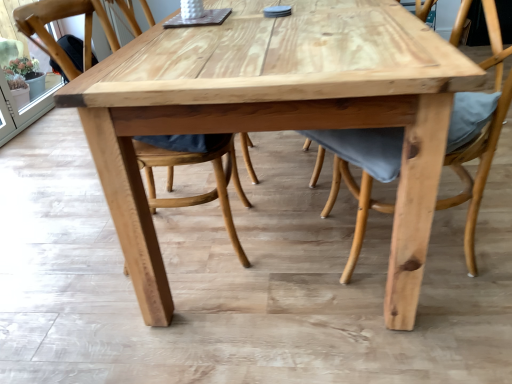
This screenshot has width=512, height=384. What do you see at coordinates (201, 194) in the screenshot?
I see `natural wood chair at center, which appears as the 2th chair when viewed from the right` at bounding box center [201, 194].

Where is `natural wood chair at center, the 1th chair from the left`? The width and height of the screenshot is (512, 384). natural wood chair at center, the 1th chair from the left is located at coordinates (201, 194).

The width and height of the screenshot is (512, 384). What do you see at coordinates (480, 141) in the screenshot? I see `natural wood chair at center, placed as the 2th chair when sorted from left to right` at bounding box center [480, 141].

At what (x,y) coordinates should I click in order to perform the action: click on natural wood chair at center, placed as the 2th chair when sorted from left to right. Please return your answer as a coordinate pair (x, y). Looking at the image, I should click on (480, 141).

At what (x,y) coordinates should I click in order to perform the action: click on natural wood chair at center, the 1th chair from the left. Please return your answer as a coordinate pair (x, y). This screenshot has height=384, width=512. Looking at the image, I should click on (201, 194).

Considering the relative positions of natural wood chair at center, the 1th chair from the left, and natural wood chair at center, placed as the 2th chair when sorted from left to right, in the image provided, is natural wood chair at center, the 1th chair from the left, to the right of natural wood chair at center, placed as the 2th chair when sorted from left to right, from the viewer's perspective?

No.

Is natural wood chair at center, which appears as the 2th chair when viewed from the right, behind natural wood chair at center, the 1th chair positioned from the right?

Yes, it is.

Which is in front, point (68, 64) or point (498, 25)?

Point (498, 25)

From the image's perspective, is natural wood chair at center, which appears as the 2th chair when viewed from the right, below natural wood chair at center, the 1th chair positioned from the right?

Actually, natural wood chair at center, which appears as the 2th chair when viewed from the right, appears above natural wood chair at center, the 1th chair positioned from the right, in the image.

From the picture: From a real-world perspective, does natural wood chair at center, the 1th chair from the left, stand above natural wood chair at center, the 1th chair positioned from the right?

Yes, from a real-world perspective, natural wood chair at center, the 1th chair from the left, is above natural wood chair at center, the 1th chair positioned from the right.

Does natural wood chair at center, the 1th chair from the left, have a lesser width compared to natural wood chair at center, the 1th chair positioned from the right?

Yes, natural wood chair at center, the 1th chair from the left, is thinner than natural wood chair at center, the 1th chair positioned from the right.

Between natural wood chair at center, which appears as the 2th chair when viewed from the right, and natural wood chair at center, the 1th chair positioned from the right, which one has more height?

Standing taller between the two is natural wood chair at center, which appears as the 2th chair when viewed from the right.

Can you confirm if natural wood chair at center, the 1th chair from the left, is bigger than natural wood chair at center, placed as the 2th chair when sorted from left to right?

No.

Would you say natural wood chair at center, the 1th chair from the left, is inside or outside natural wood chair at center, the 1th chair positioned from the right?

natural wood chair at center, the 1th chair from the left, cannot be found inside natural wood chair at center, the 1th chair positioned from the right.

Would you say natural wood chair at center, which appears as the 2th chair when viewed from the right, is a long distance from natural wood chair at center, placed as the 2th chair when sorted from left to right?

That's not correct — natural wood chair at center, which appears as the 2th chair when viewed from the right, is a little close to natural wood chair at center, placed as the 2th chair when sorted from left to right.

Does natural wood chair at center, which appears as the 2th chair when viewed from the right, turn towards natural wood chair at center, the 1th chair positioned from the right?

Yes, natural wood chair at center, which appears as the 2th chair when viewed from the right, is turned towards natural wood chair at center, the 1th chair positioned from the right.

Consider the image. How far apart are natural wood chair at center, which appears as the 2th chair when viewed from the right, and natural wood chair at center, the 1th chair positioned from the right?

A distance of 23.25 inches exists between natural wood chair at center, which appears as the 2th chair when viewed from the right, and natural wood chair at center, the 1th chair positioned from the right.

This screenshot has height=384, width=512. In order to click on chair that appears above the natural wood chair at center, placed as the 2th chair when sorted from left to right (from the image's perspective) in this screenshot , I will do `click(201, 194)`.

Considering the positions of objects natural wood chair at center, placed as the 2th chair when sorted from left to right, and natural wood chair at center, the 1th chair from the left, in the image provided, who is more to the left, natural wood chair at center, placed as the 2th chair when sorted from left to right, or natural wood chair at center, the 1th chair from the left,?

Positioned to the left is natural wood chair at center, the 1th chair from the left.

Which is behind, natural wood chair at center, placed as the 2th chair when sorted from left to right, or natural wood chair at center, which appears as the 2th chair when viewed from the right?

natural wood chair at center, which appears as the 2th chair when viewed from the right, is further from the camera.

Does point (359, 192) lie in front of point (208, 200)?

Yes, it is in front of point (208, 200).

From the image's perspective, which one is positioned lower, natural wood chair at center, the 1th chair positioned from the right, or natural wood chair at center, the 1th chair from the left?

natural wood chair at center, the 1th chair positioned from the right.

From a real-world perspective, is natural wood chair at center, placed as the 2th chair when sorted from left to right, located higher than natural wood chair at center, the 1th chair from the left?

No, from a real-world perspective, natural wood chair at center, placed as the 2th chair when sorted from left to right, is not above natural wood chair at center, the 1th chair from the left.

Which object is thinner, natural wood chair at center, placed as the 2th chair when sorted from left to right, or natural wood chair at center, the 1th chair from the left?

With smaller width is natural wood chair at center, the 1th chair from the left.

Is natural wood chair at center, placed as the 2th chair when sorted from left to right, taller than natural wood chair at center, the 1th chair from the left?

No.

Considering the sizes of objects natural wood chair at center, placed as the 2th chair when sorted from left to right, and natural wood chair at center, the 1th chair from the left, in the image provided, who is bigger, natural wood chair at center, placed as the 2th chair when sorted from left to right, or natural wood chair at center, the 1th chair from the left,?

With larger size is natural wood chair at center, placed as the 2th chair when sorted from left to right.

Is natural wood chair at center, the 1th chair from the left, inside natural wood chair at center, the 1th chair positioned from the right?

Definitely not — natural wood chair at center, the 1th chair from the left, is not inside natural wood chair at center, the 1th chair positioned from the right.

Is natural wood chair at center, placed as the 2th chair when sorted from left to right, with natural wood chair at center, which appears as the 2th chair when viewed from the right?

No, natural wood chair at center, placed as the 2th chair when sorted from left to right, is not making contact with natural wood chair at center, which appears as the 2th chair when viewed from the right.

Is natural wood chair at center, the 1th chair positioned from the right, aimed at natural wood chair at center, which appears as the 2th chair when viewed from the right?

Yes, natural wood chair at center, the 1th chair positioned from the right, is oriented towards natural wood chair at center, which appears as the 2th chair when viewed from the right.

How different are the orientations of natural wood chair at center, placed as the 2th chair when sorted from left to right, and natural wood chair at center, the 1th chair from the left, in degrees?

They differ by 180 degrees in their facing directions.

Where is `chair on the left of the natural wood chair at center, placed as the 2th chair when sorted from left to right`? chair on the left of the natural wood chair at center, placed as the 2th chair when sorted from left to right is located at coordinates [201, 194].

Identify the location of chair on the right side of natural wood chair at center, which appears as the 2th chair when viewed from the right. (480, 141).

Identify the location of chair on the left of the natural wood chair at center, the 1th chair positioned from the right. (201, 194).